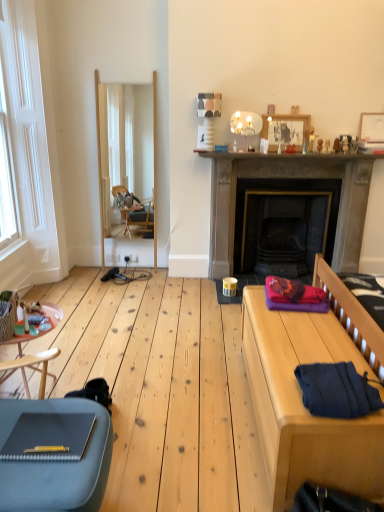
Where is `free space behind dark blue knitted sweater at lower right`? The height and width of the screenshot is (512, 384). free space behind dark blue knitted sweater at lower right is located at coordinates (319, 353).